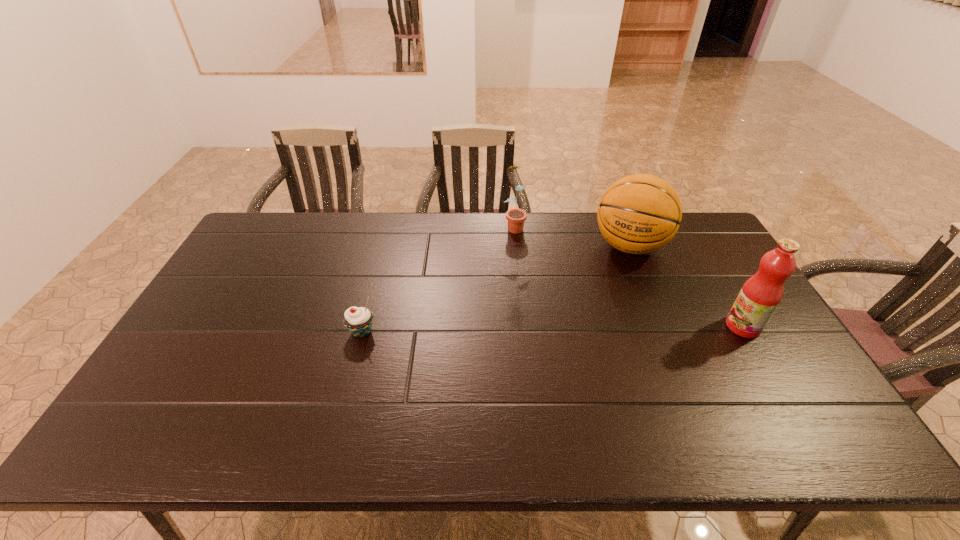
You are a GUI agent. You are given a task and a screenshot of the screen. Output one action in this format:
    pyautogui.click(x=<x>, y=<y>)
    Task: Click on the vacant space at the left edge of the desktop
    
    Given the screenshot: What is the action you would take?
    pyautogui.click(x=232, y=347)

Where is `vacant space at the right edge of the desktop`? vacant space at the right edge of the desktop is located at coordinates (695, 264).

What are the coordinates of `free space between the second object from right to left and the second object from left to right` in the screenshot? It's located at coord(572,236).

This screenshot has width=960, height=540. Find the location of `blank region between the cupcake and the fruit juice`. blank region between the cupcake and the fruit juice is located at coordinates (552, 329).

You are a GUI agent. You are given a task and a screenshot of the screen. Output one action in this format:
    pyautogui.click(x=<x>, y=<y>)
    Task: Click on the unoccupied area between the rightmost object and the shortest object
    The image size is (960, 540).
    Given the screenshot: What is the action you would take?
    pyautogui.click(x=552, y=329)

Locate an element on the screen. This screenshot has width=960, height=540. free space that is in between the cupcake and the second object from left to right is located at coordinates (438, 279).

The width and height of the screenshot is (960, 540). Find the location of `free spot between the second object from left to right and the second object from right to left`. free spot between the second object from left to right and the second object from right to left is located at coordinates (572, 236).

Identify the location of vacant space that's between the leftmost object and the sunflower. The width and height of the screenshot is (960, 540). (438, 279).

Find the location of a particular element. free space between the sunflower and the leftmost object is located at coordinates pyautogui.click(x=438, y=279).

Locate an element on the screen. vacant area that lies between the leftmost object and the sunflower is located at coordinates click(x=438, y=279).